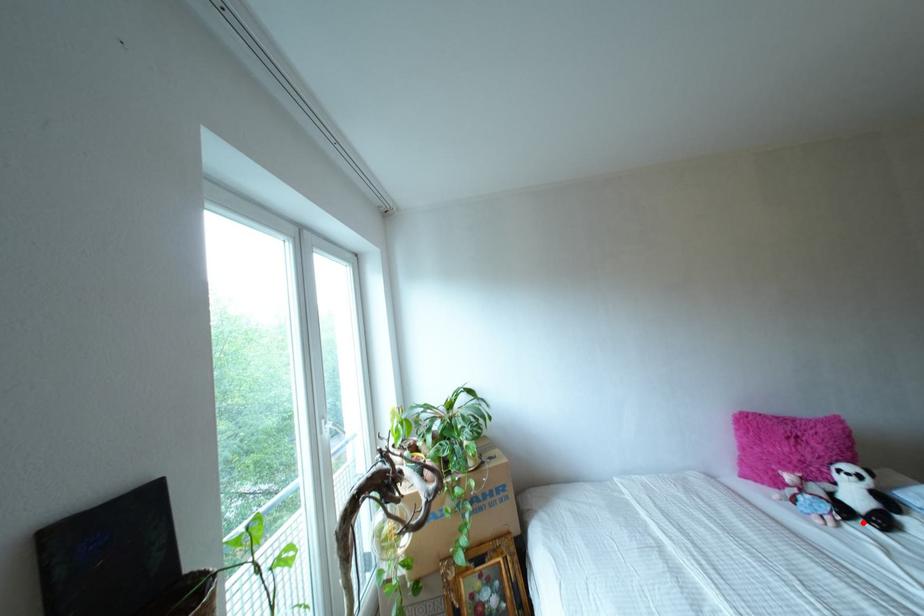
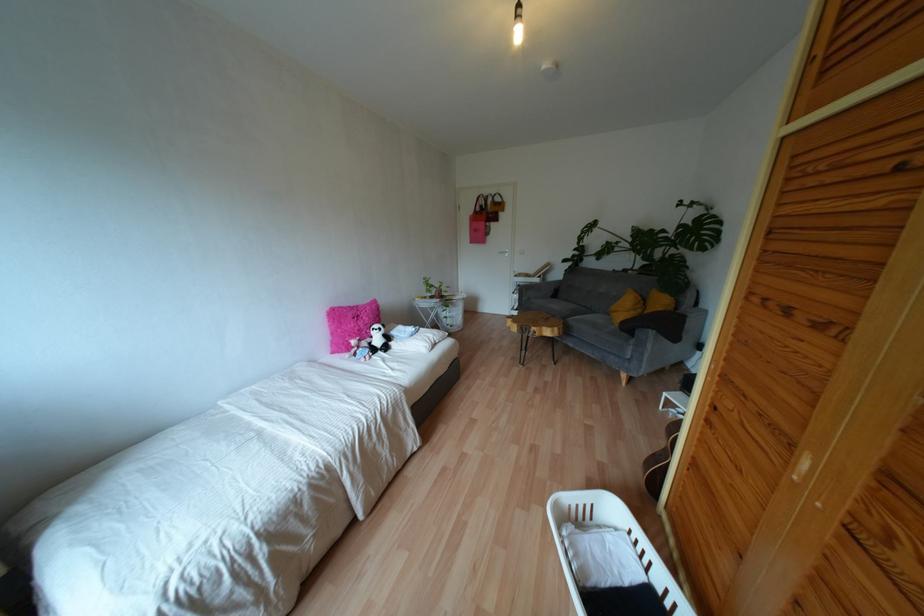
The point at the highlighted location is marked in the first image. Where is the corresponding point in the second image?

(379, 352)